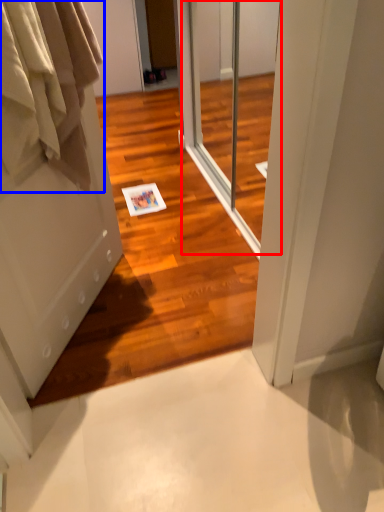
Question: Among these objects, which one is farthest to the camera, screen door (highlighted by a red box) or clothing (highlighted by a blue box)?

Choices:
 (A) screen door
 (B) clothing

Answer: (A)